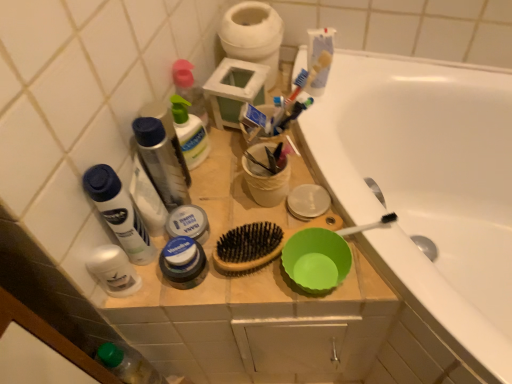
Where is `vacant area that lies to the right of matte blue jar at center, acting as the second toiletry starting from the bottom`? The height and width of the screenshot is (384, 512). vacant area that lies to the right of matte blue jar at center, acting as the second toiletry starting from the bottom is located at coordinates (284, 264).